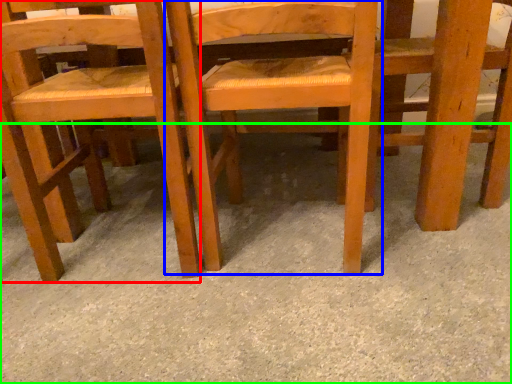
Question: Which object is positioned farthest from chair (highlighted by a red box)? Select from chair (highlighted by a blue box) and concrete (highlighted by a green box).

Choices:
 (A) chair
 (B) concrete

Answer: (B)